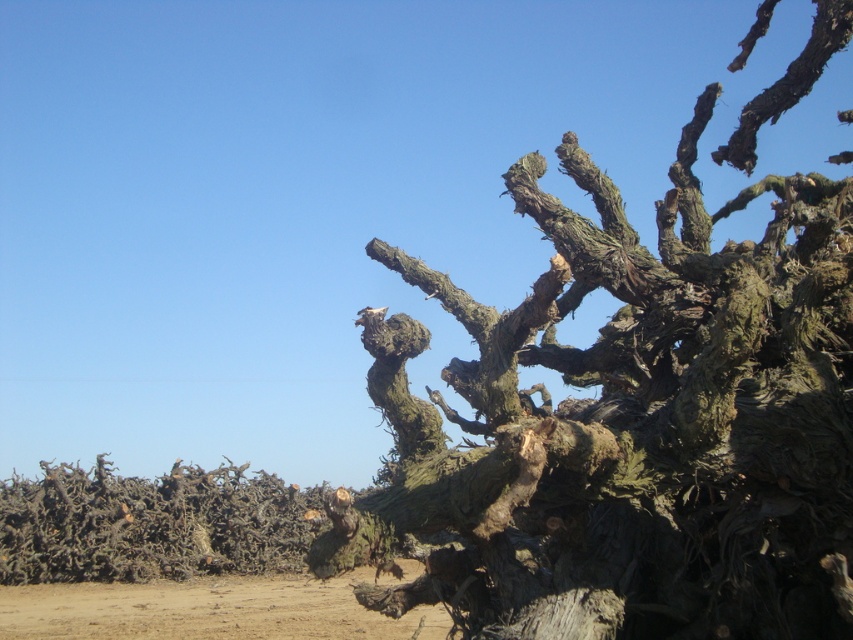
Who is positioned more to the left, greenish-brown rough bark at upper right or brown sandy dirt at lower left?

brown sandy dirt at lower left is more to the left.

Is point (595, 560) behind point (61, 618)?

That is False.

Identify the location of greenish-brown rough bark at upper right. (631, 426).